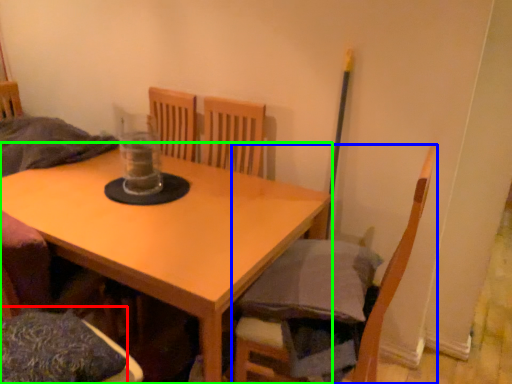
Question: Which object is the farthest from pillow (highlighted by a red box)? Choose among these: chair (highlighted by a blue box) or table (highlighted by a green box).

Choices:
 (A) chair
 (B) table

Answer: (A)